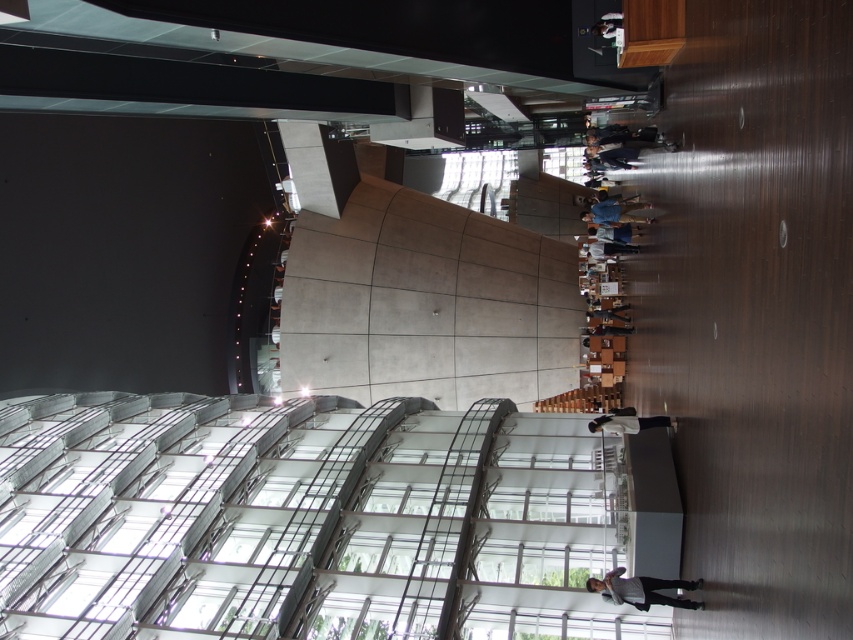
Based on the photo, is white shirt at center thinner than dark gray concrete person at center?

Incorrect, white shirt at center's width is not less than dark gray concrete person at center's.

Based on the photo, does white shirt at center come behind dark gray concrete person at center?

No, it is not.

Identify the location of white shirt at center. This screenshot has height=640, width=853. (642, 589).

Can you confirm if white matte jacket at center is positioned below denim jacket at center?

Indeed, white matte jacket at center is positioned under denim jacket at center.

Does point (587, 426) come behind point (635, 218)?

No, it is in front of (635, 218).

The width and height of the screenshot is (853, 640). Describe the element at coordinates (627, 420) in the screenshot. I see `white matte jacket at center` at that location.

Locate an element on the screen. white matte jacket at center is located at coordinates (627, 420).

Measure the distance between white matte jacket at center and camera.

white matte jacket at center is 97.94 feet away from camera.

Is white matte jacket at center bigger than dark gray concrete person at center?

Yes.

Which is behind, point (622, 410) or point (589, 310)?

The point (589, 310) is more distant.

You are a GUI agent. You are given a task and a screenshot of the screen. Output one action in this format:
    pyautogui.click(x=<x>, y=<y>)
    Task: Click on the white matte jacket at center
    The height and width of the screenshot is (640, 853).
    Given the screenshot: What is the action you would take?
    pyautogui.click(x=627, y=420)